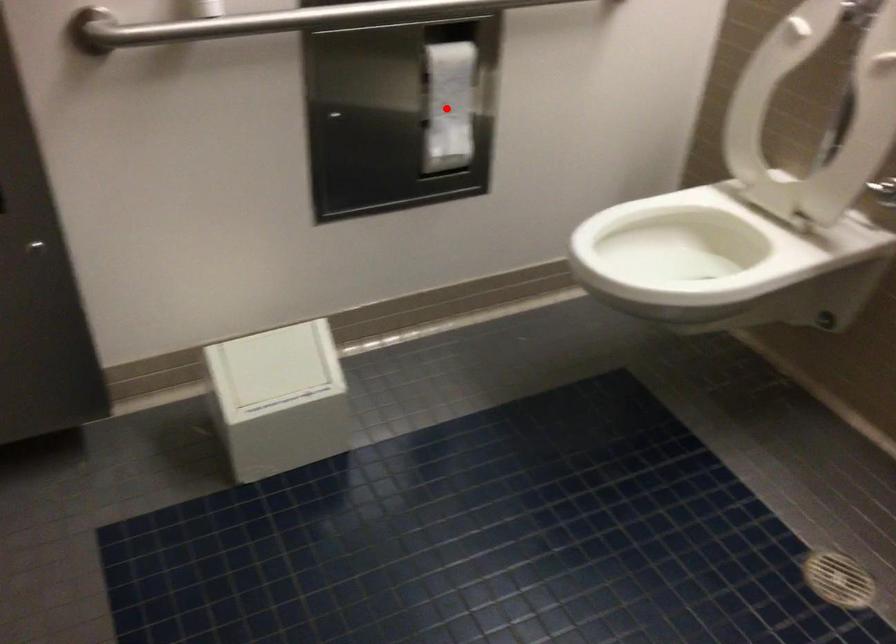
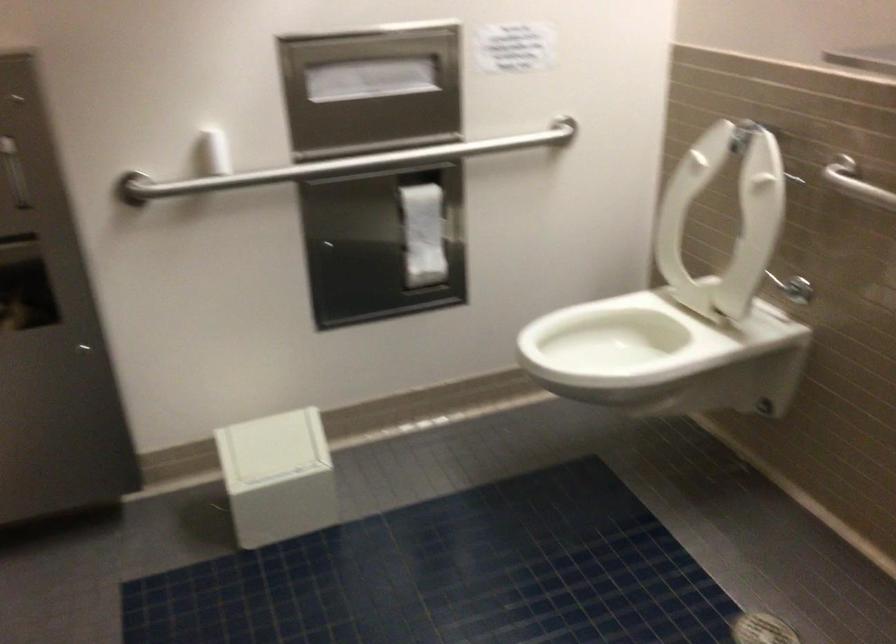
Where in the second image is the point corresponding to the highlighted location from the first image?

(423, 234)